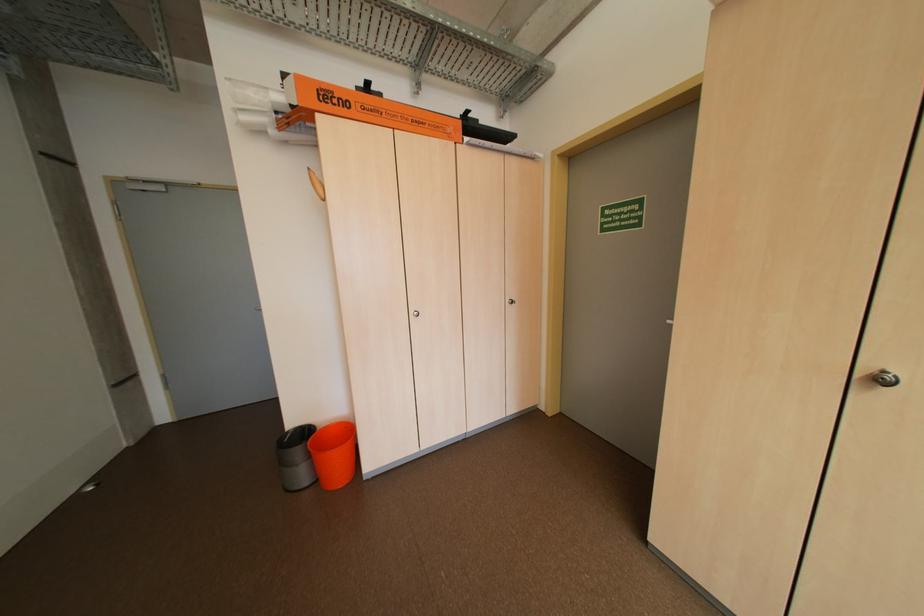
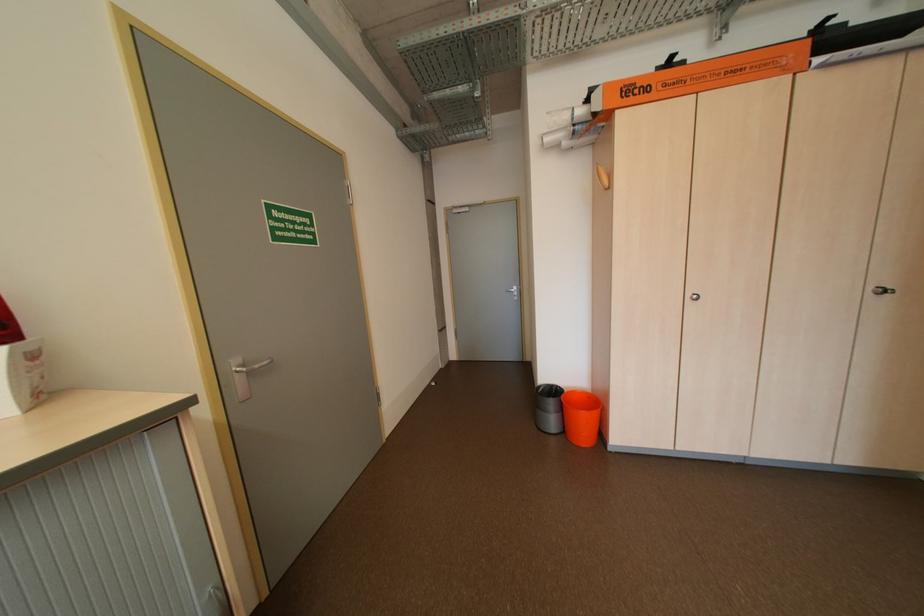
In the second image, find the point that corresponds to the point at 521,304 in the first image.

(894, 293)